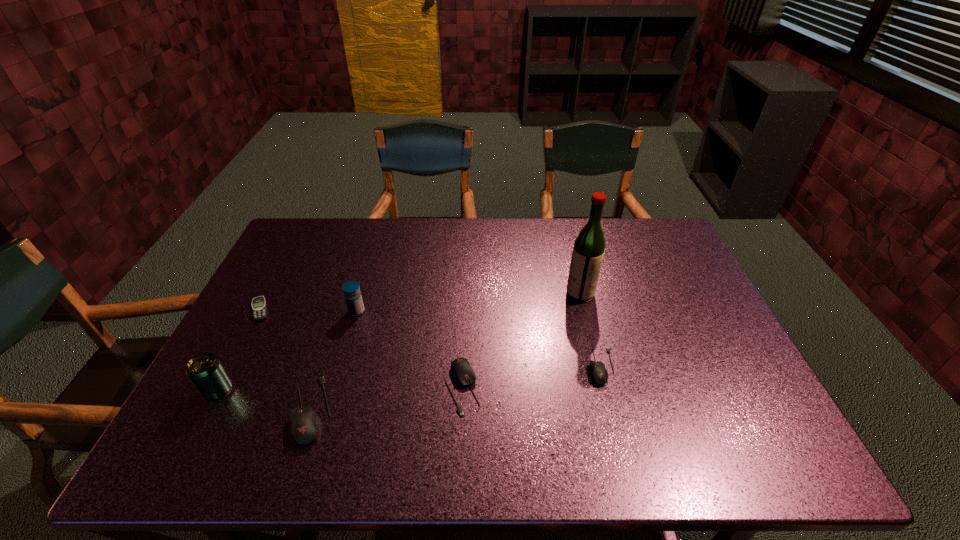
Considering the uniform spacing of mouses, where should an additional mouse be positioned on the right? Please locate a free spot. Please provide its 2D coordinates. Your answer should be formatted as a tuple, i.e. [(x, y)], where the tuple contains the x and y coordinates of a point satisfying the conditions above.

[(729, 347)]